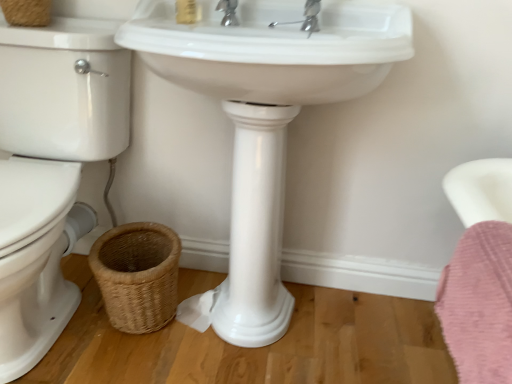
Question: Considering the relative positions of white glossy sink at center and chrome metallic faucet at upper center in the image provided, is white glossy sink at center to the right of chrome metallic faucet at upper center from the viewer's perspective?

Choices:
 (A) no
 (B) yes

Answer: (B)

Question: Does white glossy sink at center come behind chrome metallic faucet at upper center?

Choices:
 (A) yes
 (B) no

Answer: (B)

Question: From the image's perspective, is white glossy sink at center under chrome metallic faucet at upper center?

Choices:
 (A) no
 (B) yes

Answer: (B)

Question: Can you confirm if white glossy sink at center is wider than chrome metallic faucet at upper center?

Choices:
 (A) yes
 (B) no

Answer: (A)

Question: From a real-world perspective, is white glossy sink at center beneath chrome metallic faucet at upper center?

Choices:
 (A) yes
 (B) no

Answer: (A)

Question: Can you confirm if white glossy sink at center is shorter than chrome metallic faucet at upper center?

Choices:
 (A) no
 (B) yes

Answer: (A)

Question: Can you confirm if white glossy sink at center is bigger than pink fluffy bath towel at lower right?

Choices:
 (A) yes
 (B) no

Answer: (A)

Question: Would you consider white glossy sink at center to be distant from pink fluffy bath towel at lower right?

Choices:
 (A) no
 (B) yes

Answer: (A)

Question: Could you tell me if white glossy sink at center is turned towards pink fluffy bath towel at lower right?

Choices:
 (A) yes
 (B) no

Answer: (B)

Question: From a real-world perspective, is white glossy sink at center beneath pink fluffy bath towel at lower right?

Choices:
 (A) yes
 (B) no

Answer: (B)

Question: Does white glossy sink at center appear on the left side of pink fluffy bath towel at lower right?

Choices:
 (A) yes
 (B) no

Answer: (A)

Question: Is white glossy sink at center closer to camera compared to pink fluffy bath towel at lower right?

Choices:
 (A) yes
 (B) no

Answer: (B)

Question: Considering the relative sizes of matte gold soap at upper center and white glossy sink at center in the image provided, is matte gold soap at upper center smaller than white glossy sink at center?

Choices:
 (A) yes
 (B) no

Answer: (A)